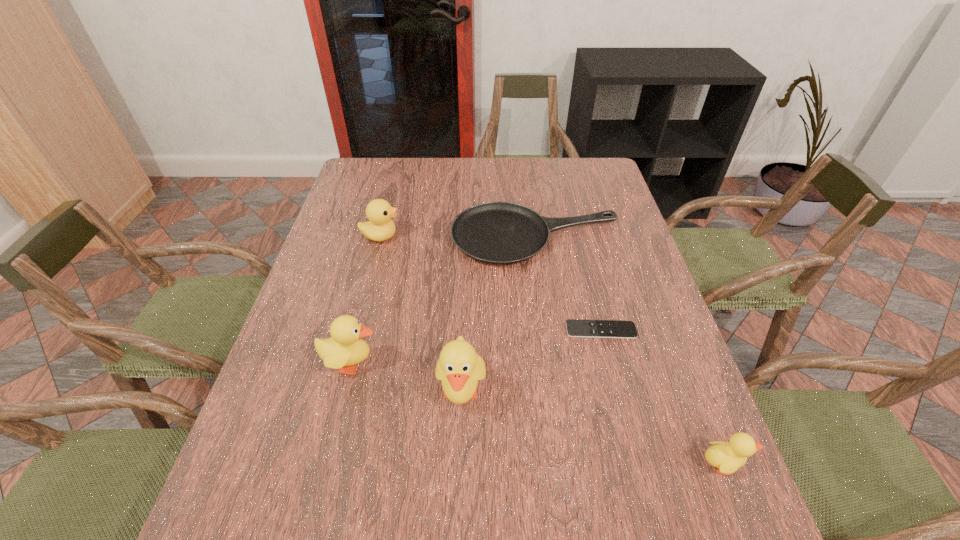
Locate an element on the screen. This screenshot has height=540, width=960. the second tallest object is located at coordinates (345, 347).

This screenshot has height=540, width=960. Find the location of `the leftmost duckling`. the leftmost duckling is located at coordinates (345, 347).

In order to click on the second duckling from right to left in this screenshot , I will do `click(459, 368)`.

What are the coordinates of `the shortest duckling` in the screenshot? It's located at (727, 457).

Locate an element on the screen. The image size is (960, 540). the nearest duckling is located at coordinates (727, 457).

Where is `duck`? The width and height of the screenshot is (960, 540). duck is located at coordinates (380, 227).

Where is `frying pan`? The width and height of the screenshot is (960, 540). frying pan is located at coordinates click(501, 233).

Locate an element on the screen. the fourth nearest object is located at coordinates (575, 328).

I want to click on remote control, so click(575, 328).

Where is `free space located on the front-facing side of the leftmost duckling`? The image size is (960, 540). free space located on the front-facing side of the leftmost duckling is located at coordinates (531, 363).